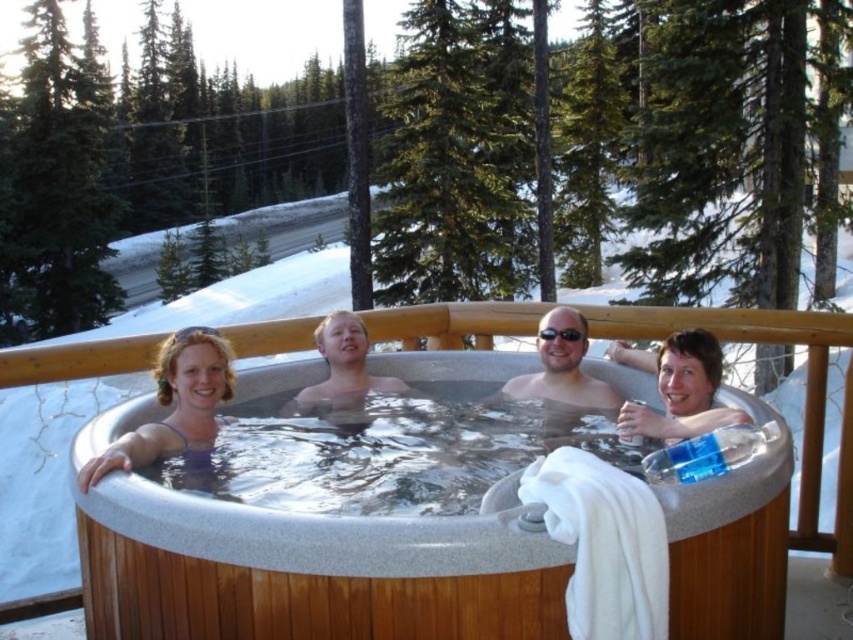
You are a photographer standing at the edge of the snowy area. You want to take a photo of the matte purple swimsuit at center and the matte plastic cup at upper right. If your camera can focus on objects within 1.5 meters, will both objects be in focus?

The matte plastic cup at upper right is 1.82 meters away from the matte purple swimsuit at center. Since the camera can only focus within 1.5 meters, the distance between them exceeds the focus range, so both objects might not be in focus simultaneously.

You are a photographer standing near the gray wood hot tub at center and the matte purple swimsuit at center. You want to capture a photo where both objects are clearly visible. Which object should you focus on to ensure both are in frame?

Since the gray wood hot tub at center is bigger than the matte purple swimsuit at center, you should focus on the gray wood hot tub at center to ensure both are in frame as it takes up more space.